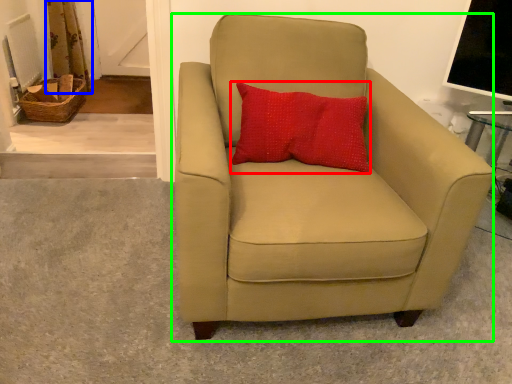
Question: Which object is the closest to the pillow (highlighted by a red box)? Choose among these: curtain (highlighted by a blue box) or chair (highlighted by a green box).

Choices:
 (A) curtain
 (B) chair

Answer: (B)